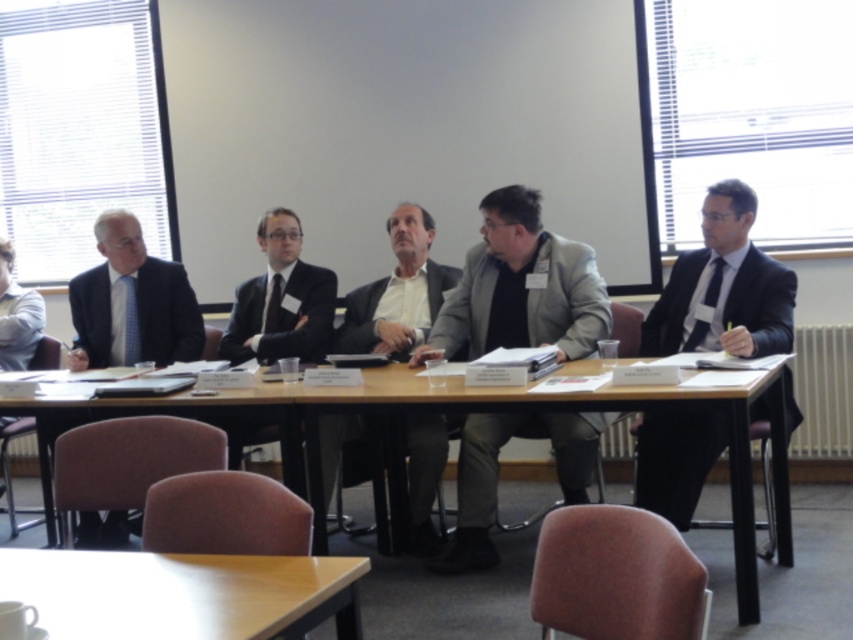
You are a conference organizer who needs to place a 2.0 meter long banner between the light brown wood table at lower left and the matte black suit at right. Will the banner fit without overlapping either object?

The distance between the light brown wood table at lower left and the matte black suit at right is 2.19 meters. Since the banner is 2.0 meters long, it will fit with 0.19 meters of space remaining between them.

You are organizing a meeting and need to place a nameplate for a guest. The guest will be sitting at point (521, 288). What object is located at that point where you need to place the nameplate?

The gray fabric jacket at center is located at point (521, 288), so you should place the nameplate there.

You are attending a meeting and need to hand a document to the person wearing the gray fabric jacket at center and the matte gray suit at center. Which one can you reach without moving from your current position?

The gray fabric jacket at center is closer to the viewer than the matte gray suit at center, so you can reach the person wearing the gray fabric jacket at center without moving.